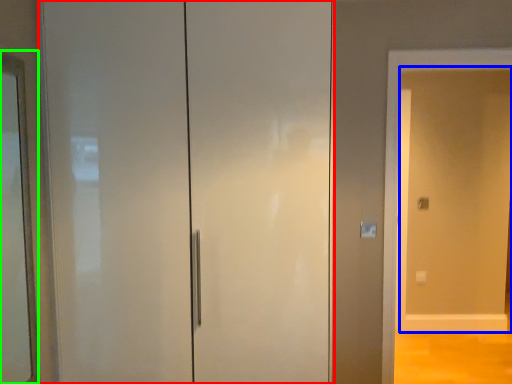
Question: Which object is positioned farthest from door (highlighted by a red box)? Select from screen door (highlighted by a blue box) and mirror (highlighted by a green box).

Choices:
 (A) screen door
 (B) mirror

Answer: (A)